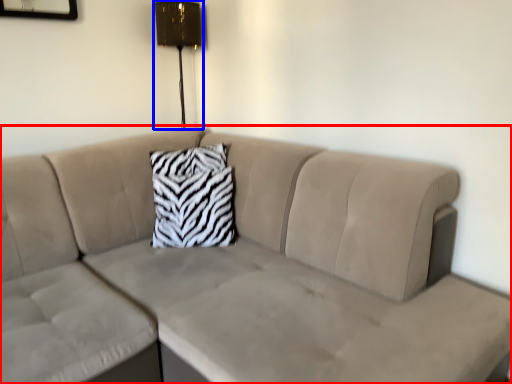
Question: Among these objects, which one is nearest to the camera, studio couch (highlighted by a red box) or lamp (highlighted by a blue box)?

Choices:
 (A) studio couch
 (B) lamp

Answer: (A)